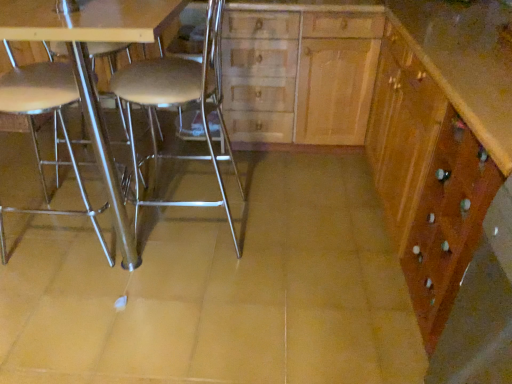
This screenshot has width=512, height=384. I want to click on wooden cabinet at right, so click(440, 139).

What do you see at coordinates (440, 139) in the screenshot?
I see `wooden cabinet at right` at bounding box center [440, 139].

In order to face metallic silver table at center, should I rotate leftwards or rightwards?

A 13.265 degree turn to the left will do.

Looking at this image, what is the approximate width of metallic silver chair at left, arranged as the second chair when viewed from the right?

metallic silver chair at left, arranged as the second chair when viewed from the right, is 18.98 inches in width.

Locate an element on the screen. The height and width of the screenshot is (384, 512). metallic silver chair at left, placed as the first chair when sorted from left to right is located at coordinates tap(34, 129).

What do you see at coordinates (183, 103) in the screenshot?
I see `metallic silver stool at center, placed as the 2th chair when sorted from left to right` at bounding box center [183, 103].

This screenshot has width=512, height=384. Find the location of `wooden cabinet at right`. wooden cabinet at right is located at coordinates (440, 139).

From a real-world perspective, is metallic silver chair at left, arranged as the second chair when viewed from the right, beneath metallic silver table at center?

No, from a real-world perspective, metallic silver chair at left, arranged as the second chair when viewed from the right, is not below metallic silver table at center.

The image size is (512, 384). I want to click on chair on the left of the metallic silver table at center, so click(x=34, y=129).

Who is more distant, metallic silver chair at left, arranged as the second chair when viewed from the right, or metallic silver table at center?

metallic silver chair at left, arranged as the second chair when viewed from the right.

Could metallic silver table at center be considered to be inside metallic silver chair at left, placed as the first chair when sorted from left to right?

No, metallic silver table at center is located outside of metallic silver chair at left, placed as the first chair when sorted from left to right.

Is point (382, 26) more distant than point (454, 278)?

That is True.

From a real-world perspective, between wooden cabinet at center and wooden cabinet at right, who is vertically higher?

wooden cabinet at center, from a real-world perspective.

From the image's perspective, is wooden cabinet at center under wooden cabinet at right?

No.

Looking at this image, is wooden cabinet at center bigger or smaller than wooden cabinet at right?

In the image, wooden cabinet at center appears to be smaller than wooden cabinet at right.

Is wooden cabinet at center located outside metallic silver stool at center, placed as the 2th chair when sorted from left to right?

Indeed, wooden cabinet at center is completely outside metallic silver stool at center, placed as the 2th chair when sorted from left to right.

Are wooden cabinet at center and metallic silver stool at center, placed as the 2th chair when sorted from left to right, making contact?

No, wooden cabinet at center is not beside metallic silver stool at center, placed as the 2th chair when sorted from left to right.

At what (x,y) coordinates should I click in order to perform the action: click on dresser above the metallic silver stool at center, placed as the 2th chair when sorted from left to right (from the image's perspective). Please return your answer as a coordinate pair (x, y). The height and width of the screenshot is (384, 512). Looking at the image, I should click on (298, 72).

From the image's perspective, which one is positioned lower, metallic silver chair at left, arranged as the second chair when viewed from the right, or wooden cabinet at center?

From the image's view, metallic silver chair at left, arranged as the second chair when viewed from the right, is below.

Is metallic silver chair at left, placed as the first chair when sorted from left to right, inside or outside of wooden cabinet at center?

metallic silver chair at left, placed as the first chair when sorted from left to right, cannot be found inside wooden cabinet at center.

Between metallic silver chair at left, arranged as the second chair when viewed from the right, and wooden cabinet at center, which one appears on the right side from the viewer's perspective?

From the viewer's perspective, wooden cabinet at center appears more on the right side.

Between metallic silver chair at left, arranged as the second chair when viewed from the right, and wooden cabinet at center, which one is positioned behind?

wooden cabinet at center is further away from the camera.

From the image's perspective, would you say metallic silver table at center is positioned over metallic silver chair at left, placed as the first chair when sorted from left to right?

Correct, metallic silver table at center appears higher than metallic silver chair at left, placed as the first chair when sorted from left to right, in the image.

Is metallic silver table at center far from metallic silver chair at left, arranged as the second chair when viewed from the right?

metallic silver table at center is actually quite close to metallic silver chair at left, arranged as the second chair when viewed from the right.

At what (x,y) coordinates should I click in order to perform the action: click on chair that is the 2nd one above the metallic silver table at center (from a real-world perspective). Please return your answer as a coordinate pair (x, y). Looking at the image, I should click on (34, 129).

Considering the sizes of metallic silver table at center and metallic silver chair at left, arranged as the second chair when viewed from the right, in the image, is metallic silver table at center taller or shorter than metallic silver chair at left, arranged as the second chair when viewed from the right,?

metallic silver table at center is shorter than metallic silver chair at left, arranged as the second chair when viewed from the right.

Would you say metallic silver chair at left, arranged as the second chair when viewed from the right, is outside metallic silver stool at center, the first chair from the right?

metallic silver chair at left, arranged as the second chair when viewed from the right, lies outside metallic silver stool at center, the first chair from the right,'s area.

Can you confirm if metallic silver chair at left, arranged as the second chair when viewed from the right, is smaller than metallic silver stool at center, placed as the 2th chair when sorted from left to right?

Yes.

Who is more distant, metallic silver chair at left, placed as the first chair when sorted from left to right, or metallic silver stool at center, the first chair from the right?

Positioned behind is metallic silver stool at center, the first chair from the right.

Looking at this image, considering the relative sizes of metallic silver chair at left, arranged as the second chair when viewed from the right, and metallic silver stool at center, placed as the 2th chair when sorted from left to right, in the image provided, is metallic silver chair at left, arranged as the second chair when viewed from the right, thinner than metallic silver stool at center, placed as the 2th chair when sorted from left to right,?

Correct, the width of metallic silver chair at left, arranged as the second chair when viewed from the right, is less than that of metallic silver stool at center, placed as the 2th chair when sorted from left to right.

Looking at this image, from the image's perspective, is wooden cabinet at center over metallic silver table at center?

Yes.

Between point (283, 35) and point (182, 3), which one is positioned in front?

Positioned in front is point (182, 3).

Image resolution: width=512 pixels, height=384 pixels. Find the location of `table on the left of wooden cabinet at center`. table on the left of wooden cabinet at center is located at coordinates (85, 48).

Does wooden cabinet at center come in front of metallic silver table at center?

That is False.

This screenshot has height=384, width=512. Identify the location of table lying above the metallic silver chair at left, placed as the first chair when sorted from left to right (from the image's perspective). (85, 48).

Locate an element on the screen. The width and height of the screenshot is (512, 384). cabinetry on the right of wooden cabinet at center is located at coordinates (440, 139).

In the scene shown: From the image, which object appears to be nearer to metallic silver stool at center, placed as the 2th chair when sorted from left to right, metallic silver table at center or wooden cabinet at center?

Among the two, wooden cabinet at center is located nearer to metallic silver stool at center, placed as the 2th chair when sorted from left to right.

Estimate the real-world distances between objects in this image. Which object is further from metallic silver stool at center, placed as the 2th chair when sorted from left to right, wooden cabinet at center or metallic silver chair at left, arranged as the second chair when viewed from the right?

metallic silver chair at left, arranged as the second chair when viewed from the right.

Based on their spatial positions, is wooden cabinet at right or metallic silver table at center closer to metallic silver stool at center, the first chair from the right?

metallic silver table at center lies closer to metallic silver stool at center, the first chair from the right, than the other object.

Estimate the real-world distances between objects in this image. Which object is further from metallic silver table at center, metallic silver stool at center, placed as the 2th chair when sorted from left to right, or metallic silver chair at left, arranged as the second chair when viewed from the right?

The object further to metallic silver table at center is metallic silver stool at center, placed as the 2th chair when sorted from left to right.

Considering their positions, is wooden cabinet at center positioned further to metallic silver table at center than wooden cabinet at right?

wooden cabinet at right is positioned further to the anchor metallic silver table at center.

In the scene shown: Looking at the image, which one is located further to metallic silver table at center, wooden cabinet at center or metallic silver chair at left, placed as the first chair when sorted from left to right?

Based on the image, wooden cabinet at center appears to be further to metallic silver table at center.

Estimate the real-world distances between objects in this image. Which object is further from metallic silver stool at center, the first chair from the right, metallic silver chair at left, arranged as the second chair when viewed from the right, or metallic silver table at center?

metallic silver chair at left, arranged as the second chair when viewed from the right, is positioned further to the anchor metallic silver stool at center, the first chair from the right.

From the image, which object appears to be farther from wooden cabinet at right, metallic silver table at center or metallic silver stool at center, placed as the 2th chair when sorted from left to right?

metallic silver table at center is further to wooden cabinet at right.

You are a GUI agent. You are given a task and a screenshot of the screen. Output one action in this format:
    pyautogui.click(x=<x>, y=<y>)
    Task: Click on the table between metallic silver chair at left, arranged as the second chair when viewed from the right, and wooden cabinet at center, in the horizontal direction
    
    Given the screenshot: What is the action you would take?
    pyautogui.click(x=85, y=48)

You are a GUI agent. You are given a task and a screenshot of the screen. Output one action in this format:
    pyautogui.click(x=<x>, y=<y>)
    Task: Click on the chair between metallic silver chair at left, placed as the first chair when sorted from left to right, and wooden cabinet at right, in the horizontal direction
    The image size is (512, 384).
    Given the screenshot: What is the action you would take?
    pyautogui.click(x=183, y=103)

At what (x,y) coordinates should I click in order to perform the action: click on dresser located between metallic silver table at center and wooden cabinet at right in the left-right direction. Please return your answer as a coordinate pair (x, y). The height and width of the screenshot is (384, 512). Looking at the image, I should click on (298, 72).

Find the location of a particular element. The width and height of the screenshot is (512, 384). table located between metallic silver chair at left, arranged as the second chair when viewed from the right, and wooden cabinet at right in the left-right direction is located at coordinates (85, 48).